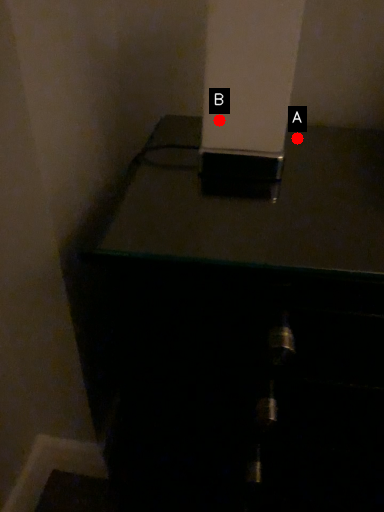
Question: Two points are circled on the image, labeled by A and B beside each circle. Which point is further to the camera?

Choices:
 (A) A is further
 (B) B is further

Answer: (A)